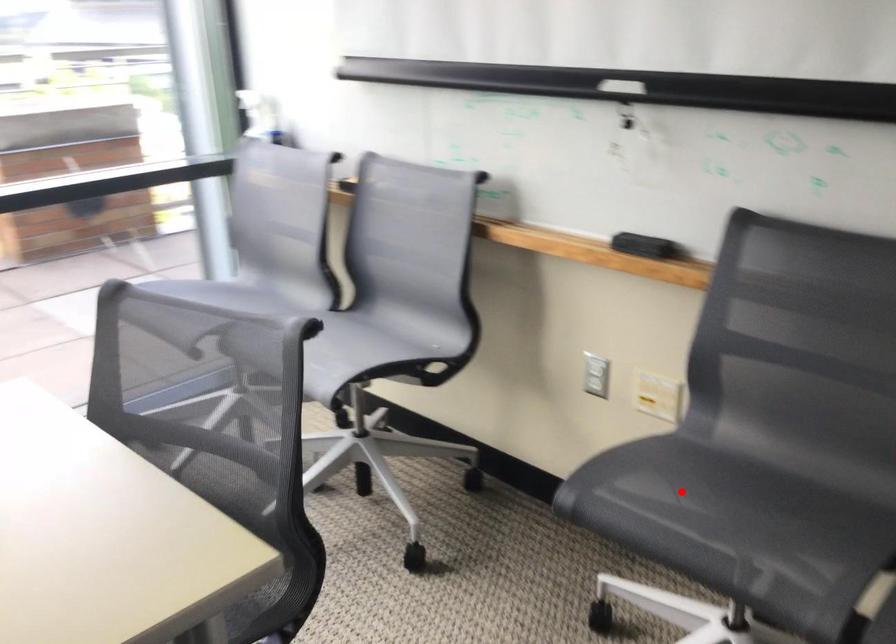
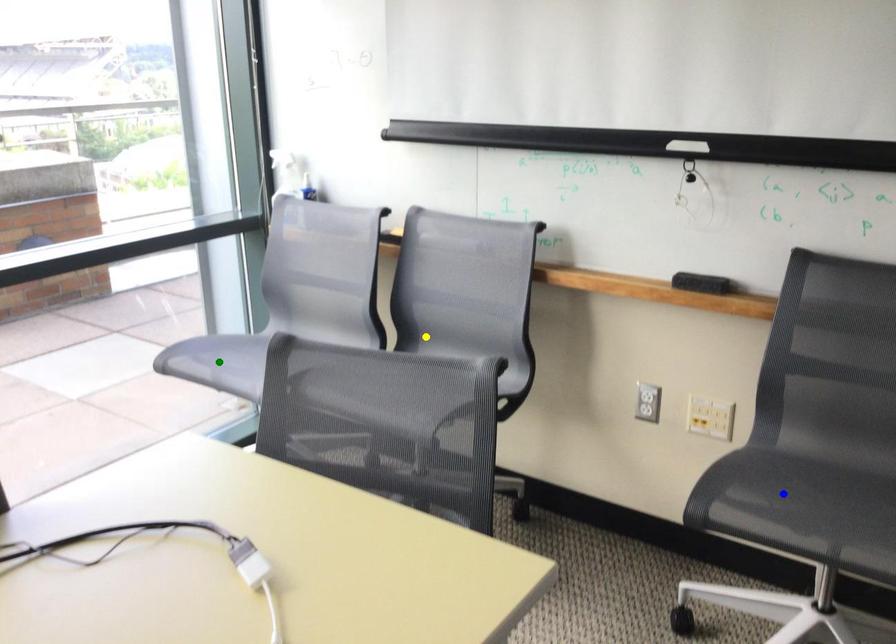
Question: I am providing you with two images of the same scene from different viewpoints. A red point is marked on the first image. You are given multiple points on the second image. In image 2, which mark is for the same physical point as the one in image 1?

Choices:
 (A) green point
 (B) blue point
 (C) yellow point

Answer: (B)